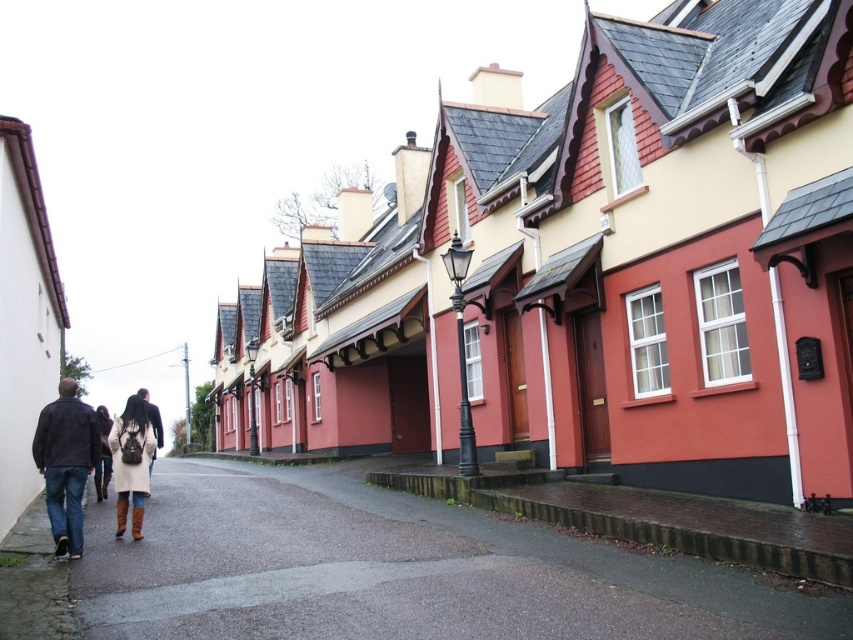
Question: Is leather boots at lower left to the left of dark brown leather jacket at center from the viewer's perspective?

Choices:
 (A) no
 (B) yes

Answer: (B)

Question: Estimate the real-world distances between objects in this image. Which object is farther from the gray asphalt pavement at lower left?

Choices:
 (A) dark brown leather jacket at lower left
 (B) dark brown leather jacket at center
 (C) leather boots at lower left
 (D) beige wool coat at lower left

Answer: (C)

Question: Which point appears farthest from the camera in this image?

Choices:
 (A) (154, 449)
 (B) (74, 403)
 (C) (108, 417)

Answer: (C)

Question: Is gray asphalt pavement at lower left below dark brown leather jacket at lower left?

Choices:
 (A) no
 (B) yes

Answer: (B)

Question: Which of the following is the farthest from the observer?

Choices:
 (A) (252, 612)
 (B) (111, 420)

Answer: (B)

Question: Is beige wool coat at lower left above dark brown leather jacket at center?

Choices:
 (A) no
 (B) yes

Answer: (B)